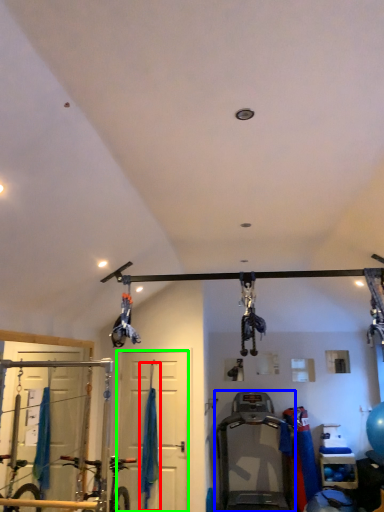
Question: Estimate the real-world distances between objects in this image. Which object is closer to curtain (highlighted by a red box), treadmill (highlighted by a blue box) or door (highlighted by a green box)?

Choices:
 (A) treadmill
 (B) door

Answer: (B)